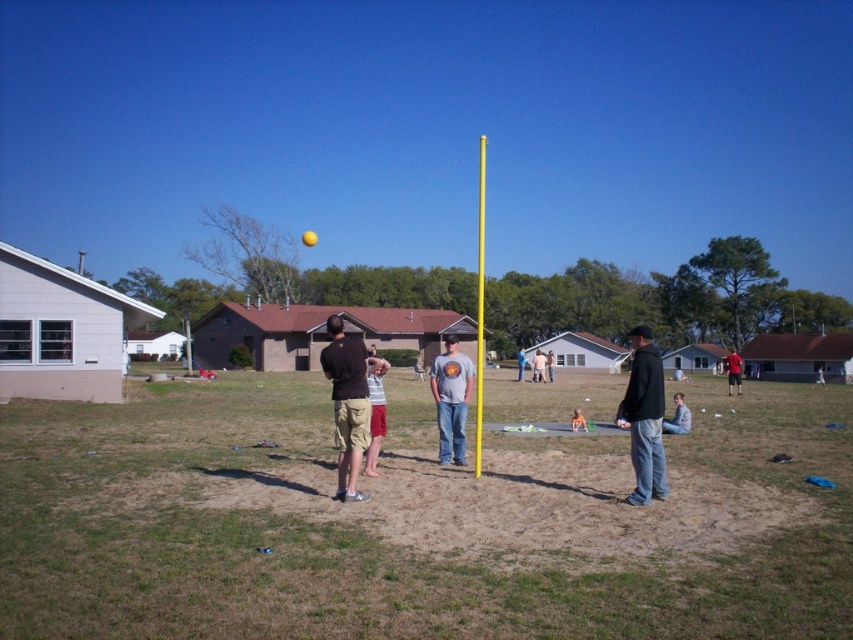
Question: Can you confirm if matte gray t-shirt at center is smaller than gray cotton shirt at center?

Choices:
 (A) no
 (B) yes

Answer: (B)

Question: Is dark gray hoodie at center above light brown wooden chair at center?

Choices:
 (A) yes
 (B) no

Answer: (A)

Question: Which of the following is the closest to the observer?

Choices:
 (A) light brown wooden chair at center
 (B) striped cotton shirt at center
 (C) yellow painted pole at center

Answer: (B)

Question: Is yellow painted pole at center below light brown wooden chair at center?

Choices:
 (A) yes
 (B) no

Answer: (B)

Question: Among these points, which one is farthest from the camera?

Choices:
 (A) (577, 426)
 (B) (444, 401)
 (C) (357, 387)
 (D) (546, 362)

Answer: (D)

Question: Which is nearer to the yellow painted pole at center?

Choices:
 (A) gray cotton t-shirt at center
 (B) gray cotton shirt at center
 (C) striped cotton shirt at center
 (D) dark gray hoodie at center

Answer: (D)